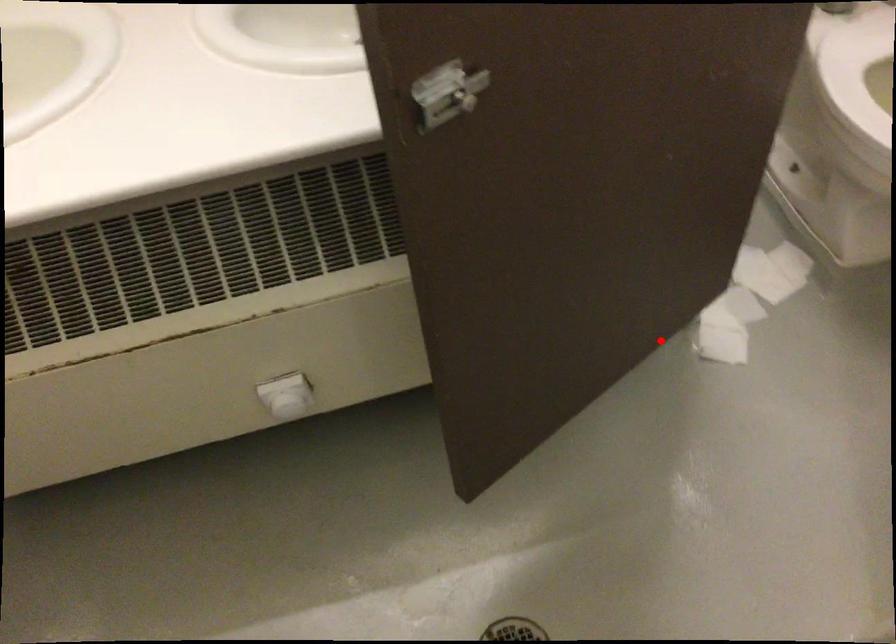
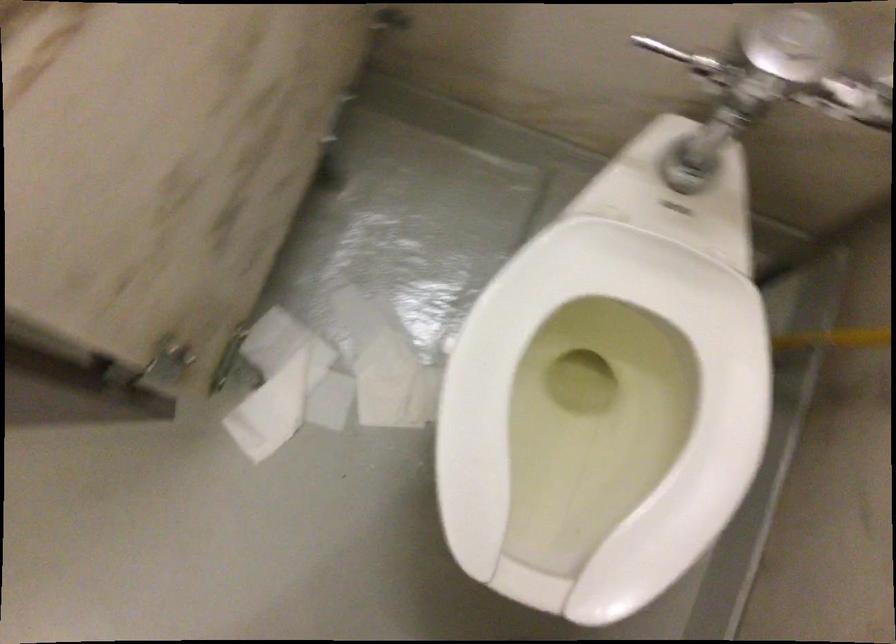
In the second image, find the point that corresponds to the highlighted location in the first image.

(185, 393)